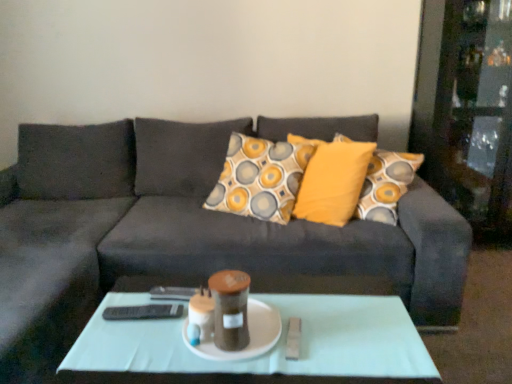
Identify the location of vacant area located to the right-hand side of white ceramic plate at center. The image size is (512, 384). (329, 336).